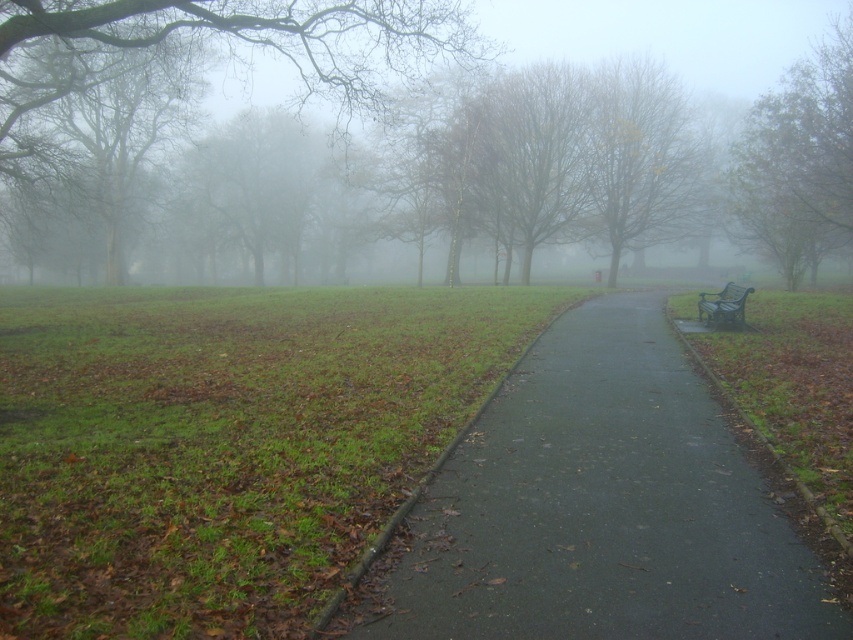
You are a GUI agent. You are given a task and a screenshot of the screen. Output one action in this format:
    pyautogui.click(x=<x>, y=<y>)
    Task: Click on the dark asphalt path at center
    This screenshot has height=640, width=853.
    Given the screenshot: What is the action you would take?
    pyautogui.click(x=599, y=508)

Does point (579, 360) come behind point (289, 8)?

No, it is in front of (289, 8).

Where is `dark asphalt path at center`? This screenshot has width=853, height=640. dark asphalt path at center is located at coordinates (599, 508).

Can you confirm if smooth bark tree at upper left is shorter than green painted metal bench at right?

No, smooth bark tree at upper left is not shorter than green painted metal bench at right.

The height and width of the screenshot is (640, 853). What do you see at coordinates (218, 36) in the screenshot?
I see `smooth bark tree at upper left` at bounding box center [218, 36].

You are a GUI agent. You are given a task and a screenshot of the screen. Output one action in this format:
    pyautogui.click(x=<x>, y=<y>)
    Task: Click on the smooth bark tree at upper left
    
    Given the screenshot: What is the action you would take?
    pyautogui.click(x=218, y=36)

Who is more distant from viewer, (837, 72) or (683, 140)?

The point (683, 140) is behind.

Who is positioned more to the left, green leafy tree at right or yellow-green foliage at center?

yellow-green foliage at center

Does point (766, 120) lie behind point (703, 156)?

That is True.

You are a GUI agent. You are given a task and a screenshot of the screen. Output one action in this format:
    pyautogui.click(x=<x>, y=<y>)
    Task: Click on the green leafy tree at right
    Image resolution: width=853 pixels, height=640 pixels.
    Given the screenshot: What is the action you would take?
    pyautogui.click(x=799, y=163)